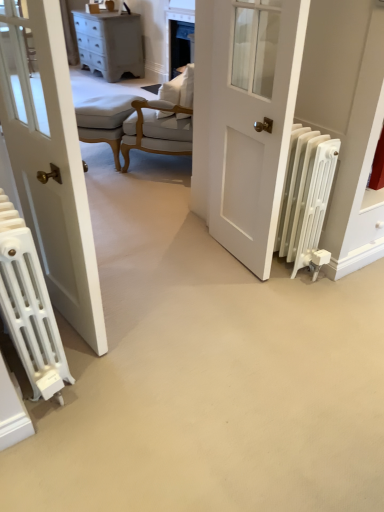
Image resolution: width=384 pixels, height=512 pixels. What do you see at coordinates (29, 307) in the screenshot?
I see `white matte radiator at lower left, the second radiator viewed from the right` at bounding box center [29, 307].

Find the location of a particular element. Image resolution: width=384 pixels, height=512 pixels. light beige fabric stool at center is located at coordinates (104, 120).

Locate an element on the screen. The height and width of the screenshot is (512, 384). matte white chest of drawers at upper left is located at coordinates click(110, 42).

At what (x,y) coordinates should I click in order to perform the action: click on white matte radiator at right, placed as the 1th radiator when sorted from right to left. Please return your answer as a coordinate pair (x, y). Looking at the image, I should click on (306, 199).

Where is `white matte door at center`? Image resolution: width=384 pixels, height=512 pixels. white matte door at center is located at coordinates click(x=244, y=120).

Is white matte radiator at lower left, the second radiator viewed from the right, outside of white matte door at center?

white matte radiator at lower left, the second radiator viewed from the right, is positioned outside white matte door at center.

Is the position of white matte radiator at lower left, the second radiator viewed from the right, less distant than that of white matte door at center?

Yes, white matte radiator at lower left, the second radiator viewed from the right, is in front of white matte door at center.

From the image's perspective, does white matte radiator at lower left, acting as the first radiator starting from the left, appear lower than white matte door at center?

Yes.

From a real-world perspective, between white matte radiator at lower left, acting as the first radiator starting from the left, and white matte door at center, who is vertically lower?

white matte radiator at lower left, acting as the first radiator starting from the left, is physically lower.

Which object is more forward, matte white chest of drawers at upper left or white matte radiator at lower left, the second radiator viewed from the right?

white matte radiator at lower left, the second radiator viewed from the right, is in front.

Which of these two, matte white chest of drawers at upper left or white matte radiator at lower left, acting as the first radiator starting from the left, stands taller?

matte white chest of drawers at upper left.

Is matte white chest of drawers at upper left oriented towards white matte radiator at lower left, acting as the first radiator starting from the left?

No.

Can you see matte white chest of drawers at upper left touching white matte radiator at lower left, the second radiator viewed from the right?

No.

How many degrees apart are the facing directions of matte white chest of drawers at upper left and white fabric chair at center?

The angle between the facing direction of matte white chest of drawers at upper left and the facing direction of white fabric chair at center is 54.9 degrees.

Would you say matte white chest of drawers at upper left is to the left or to the right of white fabric chair at center in the picture?

Clearly, matte white chest of drawers at upper left is on the left of white fabric chair at center in the image.

Image resolution: width=384 pixels, height=512 pixels. What are the coordinates of `chair in front of the matte white chest of drawers at upper left` in the screenshot? It's located at (162, 120).

Considering the relative sizes of matte white chest of drawers at upper left and white fabric chair at center in the image provided, is matte white chest of drawers at upper left shorter than white fabric chair at center?

Correct, matte white chest of drawers at upper left is not as tall as white fabric chair at center.

Is light beige fabric stool at center facing away from white matte radiator at lower left, acting as the first radiator starting from the left?

No.

From the picture: From a real-world perspective, relative to white matte radiator at lower left, acting as the first radiator starting from the left, is light beige fabric stool at center vertically above or below?

From a real-world perspective, light beige fabric stool at center is physically below white matte radiator at lower left, acting as the first radiator starting from the left.

What's the angular difference between light beige fabric stool at center and white matte radiator at lower left, the second radiator viewed from the right,'s facing directions?

There is a 145-degree angle between the facing directions of light beige fabric stool at center and white matte radiator at lower left, the second radiator viewed from the right.

Which object is positioned more to the left, light beige fabric stool at center or white matte radiator at lower left, acting as the first radiator starting from the left?

light beige fabric stool at center.

Is white matte door at center oriented away from white matte radiator at lower left, acting as the first radiator starting from the left?

No, white matte radiator at lower left, acting as the first radiator starting from the left, is not at the back of white matte door at center.

Is the surface of white matte door at center in direct contact with white matte radiator at lower left, acting as the first radiator starting from the left?

No, white matte door at center is not in contact with white matte radiator at lower left, acting as the first radiator starting from the left.

Is white matte radiator at lower left, acting as the first radiator starting from the left, surrounded by white matte door at center?

No, white matte radiator at lower left, acting as the first radiator starting from the left, is not a part of white matte door at center.

Looking at this image, from the image's perspective, who appears lower, white matte door at center or white matte radiator at lower left, the second radiator viewed from the right?

white matte radiator at lower left, the second radiator viewed from the right.

Considering the sizes of objects light beige fabric stool at center and white matte radiator at right, which is the second radiator in left-to-right order, in the image provided, who is bigger, light beige fabric stool at center or white matte radiator at right, which is the second radiator in left-to-right order,?

light beige fabric stool at center is bigger.

Can you confirm if light beige fabric stool at center is taller than white matte radiator at right, placed as the 1th radiator when sorted from right to left?

No, light beige fabric stool at center is not taller than white matte radiator at right, placed as the 1th radiator when sorted from right to left.

Is light beige fabric stool at center next to white matte radiator at right, which is the second radiator in left-to-right order, and touching it?

light beige fabric stool at center is not next to white matte radiator at right, which is the second radiator in left-to-right order, and they're not touching.

What's the angular difference between light beige fabric stool at center and white matte radiator at right, placed as the 1th radiator when sorted from right to left,'s facing directions?

The angular difference between light beige fabric stool at center and white matte radiator at right, placed as the 1th radiator when sorted from right to left, is 141 degrees.

Is white fabric chair at center far from white matte door at center?

That's not correct — white fabric chair at center is a little close to white matte door at center.

You are a GUI agent. You are given a task and a screenshot of the screen. Output one action in this format:
    pyautogui.click(x=<x>, y=<y>)
    Task: Click on the door on the right of the white fabric chair at center
    The height and width of the screenshot is (512, 384).
    Given the screenshot: What is the action you would take?
    tap(244, 120)

From the image's perspective, who appears lower, white fabric chair at center or white matte door at center?

From the image's view, white matte door at center is below.

Which object is thinner, white fabric chair at center or white matte door at center?

With smaller width is white matte door at center.

I want to click on the 2nd radiator below the white matte door at center (from the image's perspective), so click(x=29, y=307).

Identify the location of the chest of drawers above the white matte radiator at lower left, acting as the first radiator starting from the left (from the image's perspective). This screenshot has height=512, width=384. (110, 42).

From the image, which object appears to be farther from white fabric chair at center, light beige fabric stool at center or matte white chest of drawers at upper left?

matte white chest of drawers at upper left is further to white fabric chair at center.

Looking at the image, which one is located closer to light beige fabric stool at center, white matte radiator at lower left, acting as the first radiator starting from the left, or white matte door at center?

white matte door at center is positioned closer to the anchor light beige fabric stool at center.

Based on the photo, considering their positions, is white matte radiator at right, placed as the 1th radiator when sorted from right to left, positioned closer to white matte door at center than white matte radiator at lower left, the second radiator viewed from the right?

The object closer to white matte door at center is white matte radiator at right, placed as the 1th radiator when sorted from right to left.

Based on their spatial positions, is white fabric chair at center or white matte radiator at lower left, acting as the first radiator starting from the left, closer to white matte door at center?

Among the two, white fabric chair at center is located nearer to white matte door at center.

Based on their spatial positions, is matte white chest of drawers at upper left or white fabric chair at center closer to white matte door at center?

Among the two, white fabric chair at center is located nearer to white matte door at center.

Looking at the image, which one is located further to white matte radiator at lower left, acting as the first radiator starting from the left, white matte door at center or white matte radiator at right, which is the second radiator in left-to-right order?

white matte radiator at right, which is the second radiator in left-to-right order, lies further to white matte radiator at lower left, acting as the first radiator starting from the left, than the other object.

Estimate the real-world distances between objects in this image. Which object is further from white matte radiator at lower left, acting as the first radiator starting from the left, white matte radiator at right, which is the second radiator in left-to-right order, or white fabric chair at center?

Based on the image, white fabric chair at center appears to be further to white matte radiator at lower left, acting as the first radiator starting from the left.

Considering their positions, is matte white chest of drawers at upper left positioned closer to white matte radiator at lower left, acting as the first radiator starting from the left, than white matte door at center?

white matte door at center lies closer to white matte radiator at lower left, acting as the first radiator starting from the left, than the other object.

Where is `radiator between white matte door at center and matte white chest of drawers at upper left from front to back`? This screenshot has width=384, height=512. radiator between white matte door at center and matte white chest of drawers at upper left from front to back is located at coordinates (306, 199).

This screenshot has height=512, width=384. Find the location of `chair between white matte radiator at right, placed as the 1th radiator when sorted from right to left, and matte white chest of drawers at upper left, along the z-axis`. chair between white matte radiator at right, placed as the 1th radiator when sorted from right to left, and matte white chest of drawers at upper left, along the z-axis is located at coordinates (162, 120).

Image resolution: width=384 pixels, height=512 pixels. What are the coordinates of `door between white matte radiator at lower left, the second radiator viewed from the right, and white matte radiator at right, which is the second radiator in left-to-right order` in the screenshot? It's located at (244, 120).

The image size is (384, 512). Find the location of `stool positioned between white matte radiator at lower left, acting as the first radiator starting from the left, and matte white chest of drawers at upper left from near to far`. stool positioned between white matte radiator at lower left, acting as the first radiator starting from the left, and matte white chest of drawers at upper left from near to far is located at coordinates (104, 120).